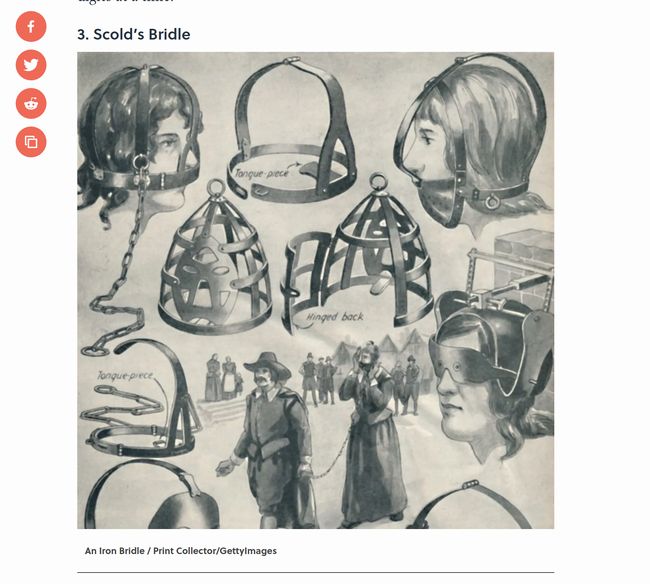
This screenshot has height=584, width=650. I want to click on brick wall, so click(x=538, y=244).